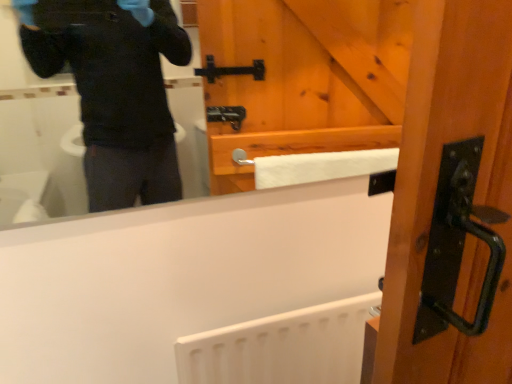
Identify the location of white matte radiator at lower center. This screenshot has width=512, height=384. (282, 347).

Measure the distance between white matte radiator at lower center and camera.

A distance of 34.72 inches exists between white matte radiator at lower center and camera.

Image resolution: width=512 pixels, height=384 pixels. What do you see at coordinates (282, 347) in the screenshot?
I see `white matte radiator at lower center` at bounding box center [282, 347].

Identify the location of white matte radiator at lower center. Image resolution: width=512 pixels, height=384 pixels. (282, 347).